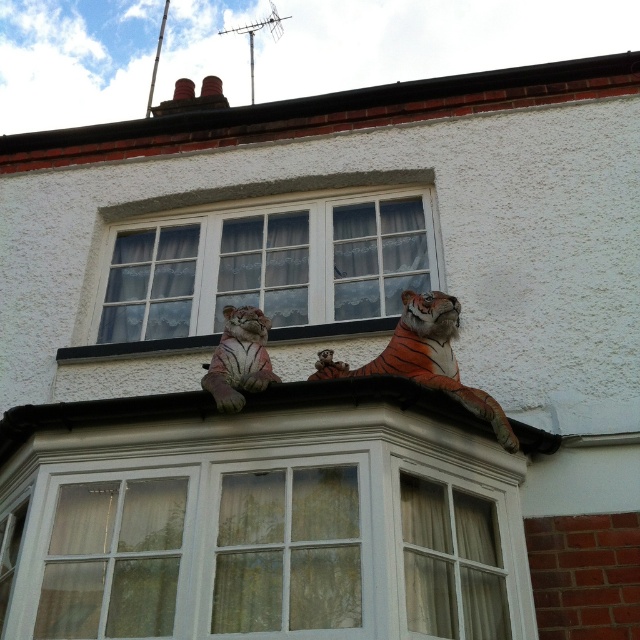
You are an architect designing a new building and want to place two tiger statues on the roof. The client mentioned they want the orange textured tiger at upper center to be more prominent than the speckled stone tiger at center. Based on the scene description, does the current arrangement meet the client requirement?

The orange textured tiger at upper center has a larger size compared to the speckled stone tiger at center, so the current arrangement meets the client requirement as the orange textured tiger at upper center is more prominent due to its larger size.

You are an architect analyzing the building structure. The white textured roof at upper center is part of the building design. Based on its position, can you determine if it is positioned towards the left or right side of the building?

The white textured roof at upper center is located at point [324,113], which places it near the left side of the building since the x coordinate is closer to 0.

Based on the photo, you are an architect inspecting a building facade. You notice a point marked at coordinates (x=426, y=358) on the image. Based on the scene description, what object is located at that point?

The point at coordinates (x=426, y=358) indicates the location of the orange textured tiger at upper center.